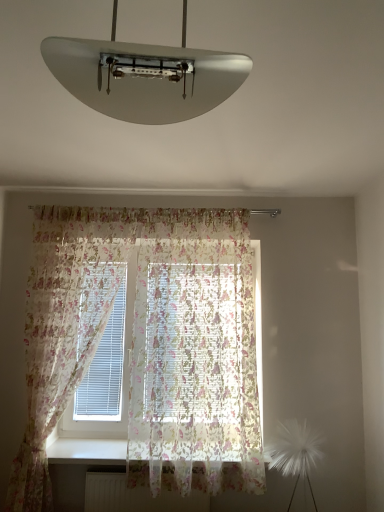
What is the approximate height of white matte radiator at lower center?

The height of white matte radiator at lower center is 23.55 centimeters.

In order to click on translucent floral curtain at center, which is the second curtain from left to right in this screenshot , I will do `click(194, 355)`.

The width and height of the screenshot is (384, 512). In order to click on white glossy lampshade at upper center in this screenshot , I will do `click(145, 76)`.

In order to click on white matte radiator at lower center in this screenshot , I will do `click(135, 496)`.

Between white glossy lampshade at upper center and translucent floral fabric at left, which is the first curtain from left to right, which one has less height?

Standing shorter between the two is white glossy lampshade at upper center.

Based on the photo, is white glossy lampshade at upper center to the left or to the right of translucent floral fabric at left, which is the second curtain from right to left, in the image?

Based on their positions, white glossy lampshade at upper center is located to the right of translucent floral fabric at left, which is the second curtain from right to left.

Are white glossy lampshade at upper center and translucent floral fabric at left, which is the first curtain from left to right, beside each other?

white glossy lampshade at upper center and translucent floral fabric at left, which is the first curtain from left to right, are clearly separated.

Which point is more forward, (85, 90) or (60, 298)?

Point (85, 90)

From the image's perspective, is white smooth window sill at lower center beneath white glossy lampshade at upper center?

Correct, white smooth window sill at lower center appears lower than white glossy lampshade at upper center in the image.

Locate an element on the screen. The image size is (384, 512). window sill below the white glossy lampshade at upper center (from the image's perspective) is located at coordinates (87, 451).

Between white smooth window sill at lower center and white glossy lampshade at upper center, which one is positioned behind?

white smooth window sill at lower center is more distant.

How far apart are translucent floral curtain at center, which is the second curtain from left to right, and white glossy lampshade at upper center?

A distance of 1.94 meters exists between translucent floral curtain at center, which is the second curtain from left to right, and white glossy lampshade at upper center.

Is translucent floral curtain at center, which is the second curtain from left to right, wider than white glossy lampshade at upper center?

Incorrect, the width of translucent floral curtain at center, which is the second curtain from left to right, does not surpass that of white glossy lampshade at upper center.

From a real-world perspective, who is located lower, translucent floral curtain at center, arranged as the first curtain when viewed from the right, or white glossy lampshade at upper center?

translucent floral curtain at center, arranged as the first curtain when viewed from the right.

Where is `lamp located in front of the translucent floral curtain at center, which is the second curtain from left to right`? This screenshot has width=384, height=512. lamp located in front of the translucent floral curtain at center, which is the second curtain from left to right is located at coordinates (145, 76).

Looking at this image, from the image's perspective, is translucent floral fabric at left, which is the second curtain from right to left, above or below white matte radiator at lower center?

Based on their image positions, translucent floral fabric at left, which is the second curtain from right to left, is located above white matte radiator at lower center.

Is point (69, 348) farther from viewer compared to point (94, 492)?

Yes, point (69, 348) is farther from viewer.

Which of these two, translucent floral fabric at left, which is the first curtain from left to right, or white matte radiator at lower center, stands taller?

translucent floral fabric at left, which is the first curtain from left to right.

This screenshot has width=384, height=512. In order to click on curtain that is on the left side of white matte radiator at lower center in this screenshot , I will do `click(142, 344)`.

Is white glossy lampshade at upper center facing away from translucent floral curtain at center, arranged as the first curtain when viewed from the right?

That's right, white glossy lampshade at upper center is facing away from translucent floral curtain at center, arranged as the first curtain when viewed from the right.

Is the depth of white glossy lampshade at upper center less than that of translucent floral curtain at center, arranged as the first curtain when viewed from the right?

Yes, white glossy lampshade at upper center is in front of translucent floral curtain at center, arranged as the first curtain when viewed from the right.

Who is bigger, white glossy lampshade at upper center or translucent floral curtain at center, arranged as the first curtain when viewed from the right?

With larger size is translucent floral curtain at center, arranged as the first curtain when viewed from the right.

From a real-world perspective, is white glossy lampshade at upper center positioned over translucent floral curtain at center, which is the second curtain from left to right, based on gravity?

Yes, from a real-world perspective, white glossy lampshade at upper center is over translucent floral curtain at center, which is the second curtain from left to right

Could you tell me if white smooth window sill at lower center is facing white matte radiator at lower center?

No, white smooth window sill at lower center is not turned towards white matte radiator at lower center.

Which is more to the left, white smooth window sill at lower center or white matte radiator at lower center?

From the viewer's perspective, white matte radiator at lower center appears more on the left side.

Is point (117, 454) closer or farther from the camera than point (162, 508)?

Point (117, 454) appears to be farther away from the viewer than point (162, 508).

Could you tell me if translucent floral curtain at center, which is the second curtain from left to right, is facing white smooth window sill at lower center?

No, translucent floral curtain at center, which is the second curtain from left to right, is not oriented towards white smooth window sill at lower center.

Which object is wider, translucent floral curtain at center, which is the second curtain from left to right, or white smooth window sill at lower center?

Wider between the two is white smooth window sill at lower center.

Could you measure the distance between translucent floral curtain at center, which is the second curtain from left to right, and white smooth window sill at lower center?

translucent floral curtain at center, which is the second curtain from left to right, and white smooth window sill at lower center are 27.52 inches apart from each other.

Based on the photo, from a real-world perspective, relative to white smooth window sill at lower center, is translucent floral curtain at center, arranged as the first curtain when viewed from the right, vertically above or below?

translucent floral curtain at center, arranged as the first curtain when viewed from the right, is situated higher than white smooth window sill at lower center in the real world.

Find the location of `curtain that is the 2nd object located below the white glossy lampshade at upper center (from the image's perspective)`. curtain that is the 2nd object located below the white glossy lampshade at upper center (from the image's perspective) is located at coordinates (142, 344).

What are the coordinates of `lamp lying on the right of white smooth window sill at lower center` in the screenshot? It's located at (145, 76).

Which object lies further to the anchor point white smooth window sill at lower center, white glossy lampshade at upper center or white matte radiator at lower center?

Based on the image, white glossy lampshade at upper center appears to be further to white smooth window sill at lower center.

Looking at this image, which object lies nearer to the anchor point white matte radiator at lower center, translucent floral fabric at left, which is the first curtain from left to right, or translucent floral curtain at center, which is the second curtain from left to right?

translucent floral curtain at center, which is the second curtain from left to right, lies closer to white matte radiator at lower center than the other object.

Based on their spatial positions, is white glossy lampshade at upper center or white smooth window sill at lower center closer to white matte radiator at lower center?

white smooth window sill at lower center is positioned closer to the anchor white matte radiator at lower center.

Which object lies further to the anchor point white smooth window sill at lower center, translucent floral fabric at left, which is the first curtain from left to right, or white glossy lampshade at upper center?

Among the two, white glossy lampshade at upper center is located further to white smooth window sill at lower center.

Which object lies further to the anchor point white matte radiator at lower center, translucent floral curtain at center, which is the second curtain from left to right, or white glossy lampshade at upper center?

white glossy lampshade at upper center is further to white matte radiator at lower center.

When comparing their distances from translucent floral fabric at left, which is the first curtain from left to right, does white matte radiator at lower center or white smooth window sill at lower center seem closer?

Among the two, white smooth window sill at lower center is located nearer to translucent floral fabric at left, which is the first curtain from left to right.

Based on the photo, looking at the image, which one is located closer to translucent floral fabric at left, which is the second curtain from right to left, translucent floral curtain at center, arranged as the first curtain when viewed from the right, or white glossy lampshade at upper center?

translucent floral curtain at center, arranged as the first curtain when viewed from the right, is positioned closer to the anchor translucent floral fabric at left, which is the second curtain from right to left.

From the picture: Considering their positions, is white glossy lampshade at upper center positioned further to white matte radiator at lower center than translucent floral fabric at left, which is the second curtain from right to left?

Based on the image, white glossy lampshade at upper center appears to be further to white matte radiator at lower center.

Identify the location of curtain between translucent floral curtain at center, which is the second curtain from left to right, and white matte radiator at lower center vertically. (142, 344).

Locate an element on the screen. Image resolution: width=384 pixels, height=512 pixels. window sill between translucent floral fabric at left, which is the second curtain from right to left, and white matte radiator at lower center vertically is located at coordinates (87, 451).

Find the location of a particular element. The image size is (384, 512). window sill between white glossy lampshade at upper center and white matte radiator at lower center in the vertical direction is located at coordinates (87, 451).

Image resolution: width=384 pixels, height=512 pixels. I want to click on curtain that lies between translucent floral curtain at center, arranged as the first curtain when viewed from the right, and white smooth window sill at lower center from top to bottom, so click(142, 344).